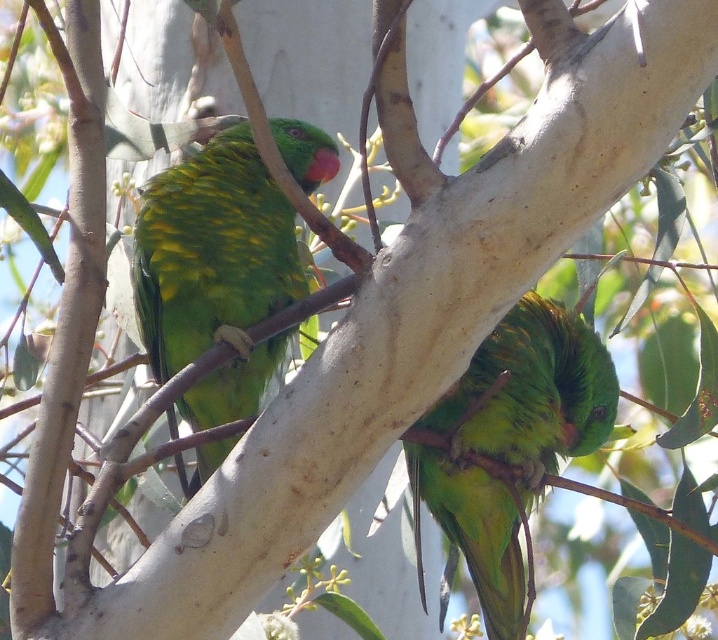
Does green matte parrot at upper left have a lesser width compared to green matte parrot at center?

Correct, green matte parrot at upper left's width is less than green matte parrot at center's.

Which of these two, green matte parrot at upper left or green matte parrot at center, stands shorter?

With less height is green matte parrot at center.

Is point (243, 234) behind point (503, 636)?

Yes, it is behind point (503, 636).

Locate an element on the screen. The image size is (718, 640). green matte parrot at upper left is located at coordinates (214, 273).